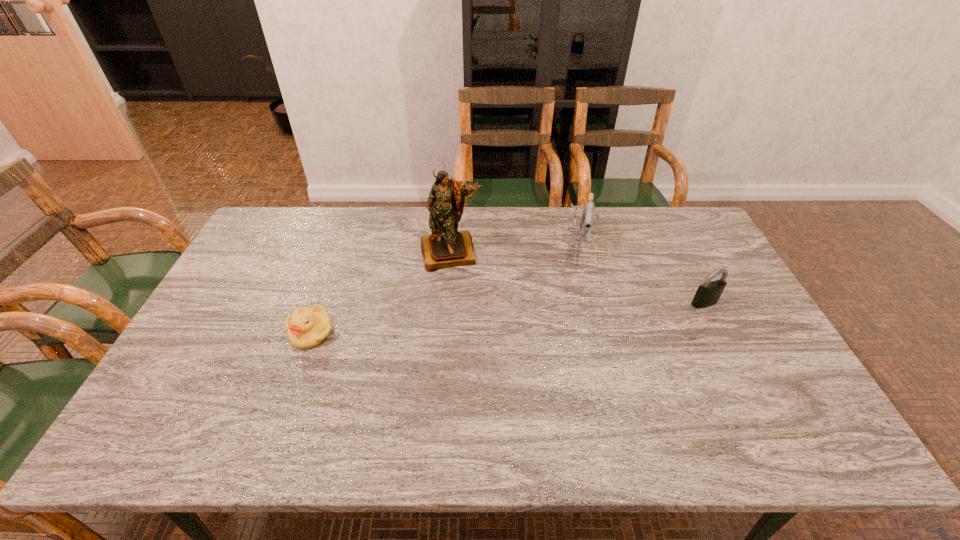
This screenshot has height=540, width=960. In order to click on vacant space at the near edge of the desktop in this screenshot , I will do `click(470, 386)`.

In the image, there is a desktop. Find the location of `vacant area at the left edge`. vacant area at the left edge is located at coordinates (258, 261).

This screenshot has width=960, height=540. I want to click on free space at the right edge of the desktop, so click(753, 320).

In the image, there is a desktop. At what (x,y) coordinates should I click in order to perform the action: click on vacant space at the far left corner. Please return your answer as a coordinate pair (x, y). The width and height of the screenshot is (960, 540). Looking at the image, I should click on (280, 216).

In the image, there is a desktop. Identify the location of vacant area at the near left corner. (208, 390).

Where is `free space between the padlock and the third object from right to left`? free space between the padlock and the third object from right to left is located at coordinates (578, 278).

You are a GUI agent. You are given a task and a screenshot of the screen. Output one action in this format:
    pyautogui.click(x=<x>, y=<y>)
    Task: Click on the free spot between the tallest object and the third object from left to right
    The width and height of the screenshot is (960, 540).
    Given the screenshot: What is the action you would take?
    pyautogui.click(x=515, y=248)

The height and width of the screenshot is (540, 960). Identify the location of free space that is in between the shortest object and the third tallest object. (508, 318).

Locate an element on the screen. Image resolution: width=960 pixels, height=540 pixels. vacant space that is in between the second shortest object and the duckling is located at coordinates 508,318.

In order to click on unoccupied area between the figurine and the second shortest object in this screenshot , I will do `click(578, 278)`.